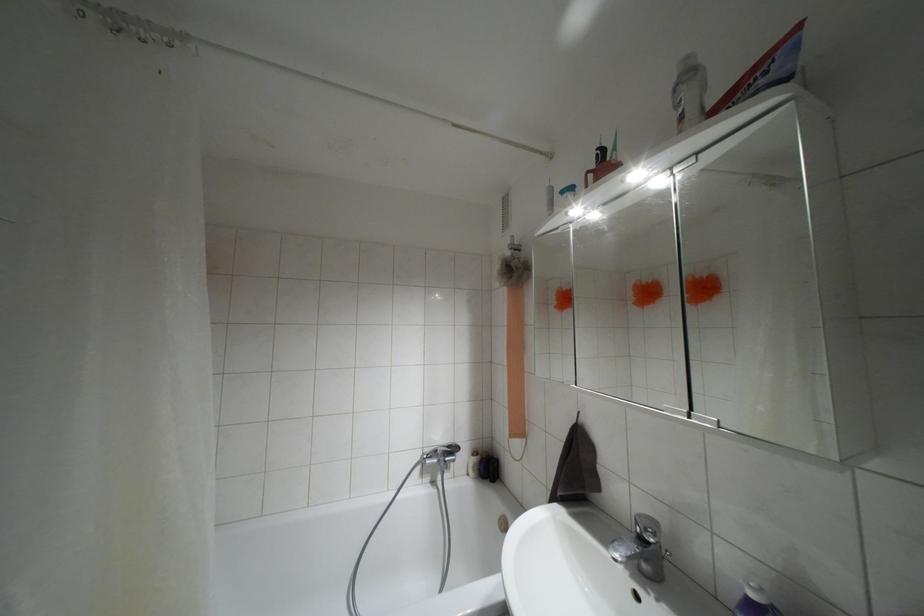
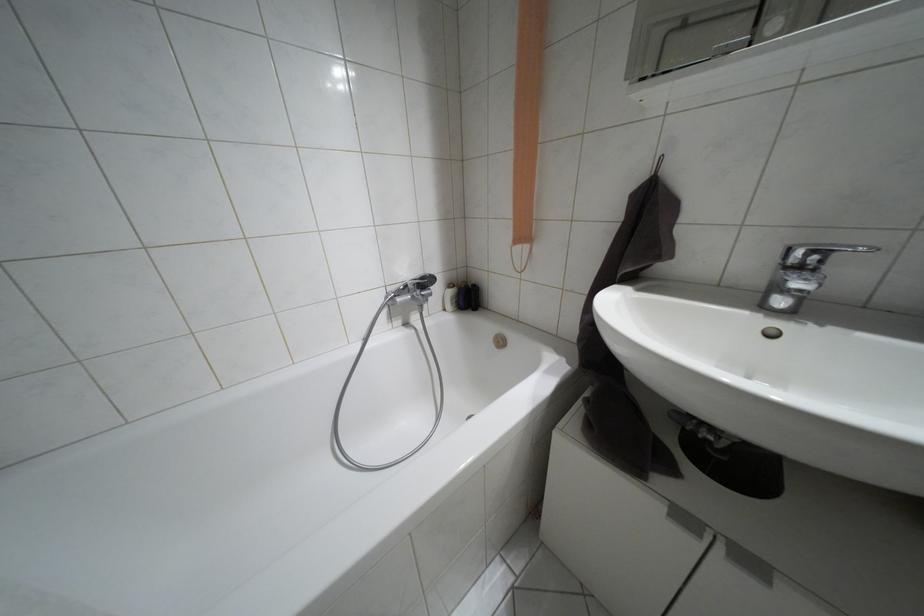
In the second image, find the point that corresponds to (475,452) in the first image.

(448, 285)